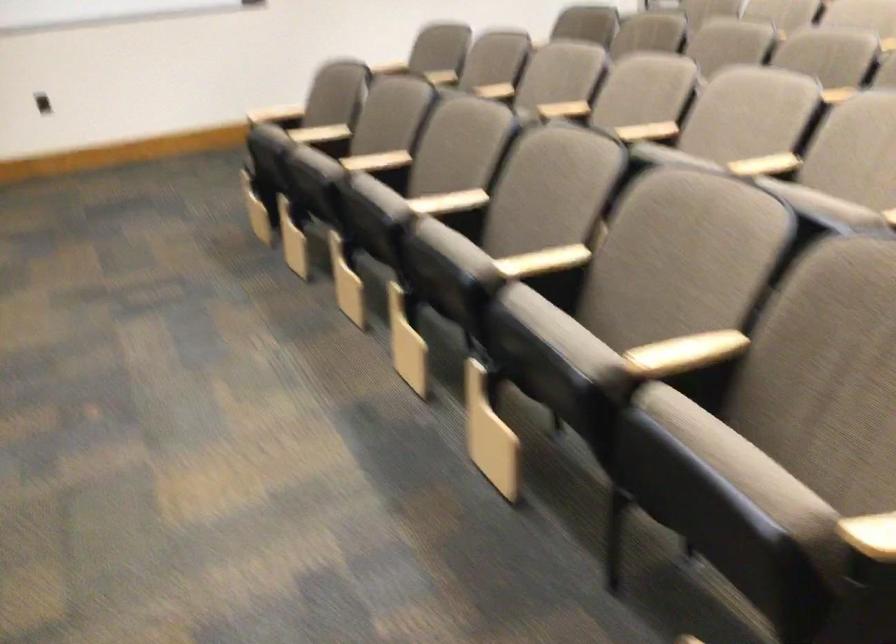
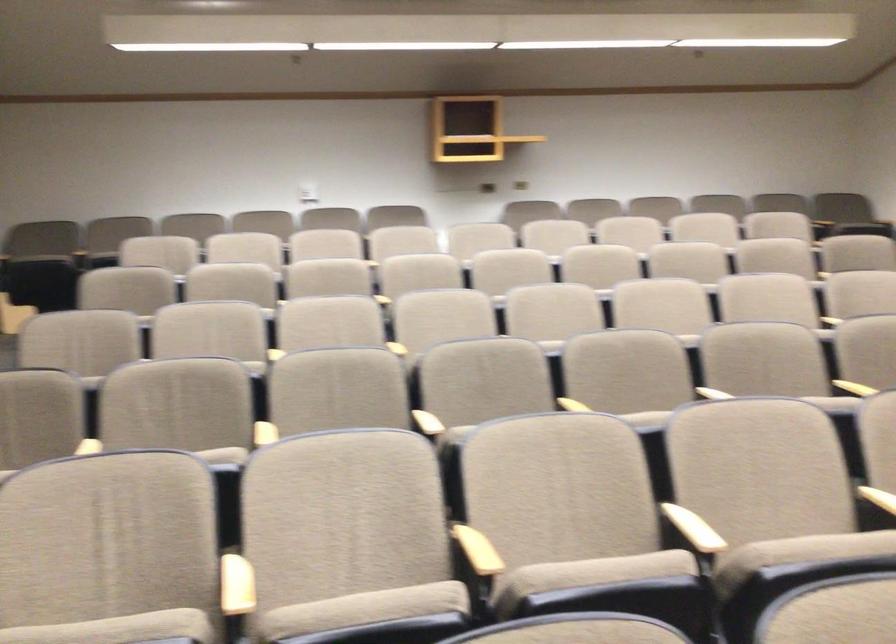
Where in the second image is the point corresponding to the point at 731,156 from the first image?

(877, 498)